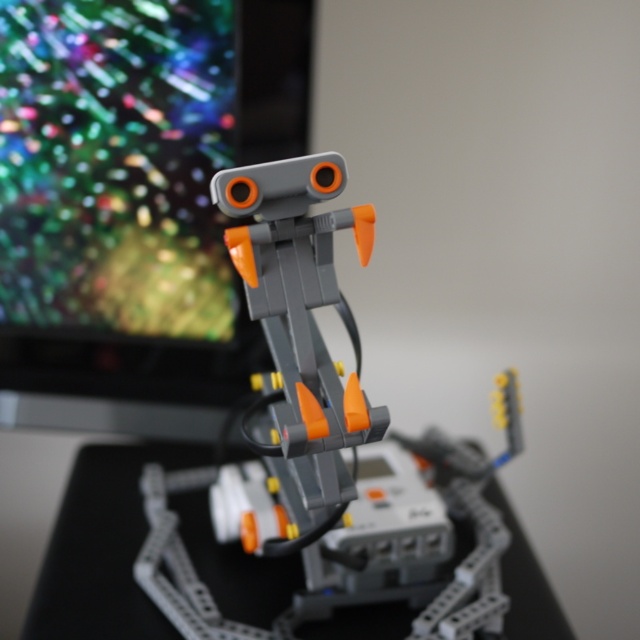
Question: Which point appears farthest from the camera in this image?

Choices:
 (A) (323, 460)
 (B) (104, 467)

Answer: (B)

Question: Does matte plastic robot at center have a smaller size compared to gray plastic table at center?

Choices:
 (A) no
 (B) yes

Answer: (B)

Question: Which point is farther from the camera taking this photo?

Choices:
 (A) (42, 493)
 (B) (355, 387)

Answer: (A)

Question: Where is matte plastic robot at center located in relation to gray plastic table at center in the image?

Choices:
 (A) right
 (B) left

Answer: (A)

Question: Does matte plastic robot at center appear over gray plastic table at center?

Choices:
 (A) no
 (B) yes

Answer: (B)